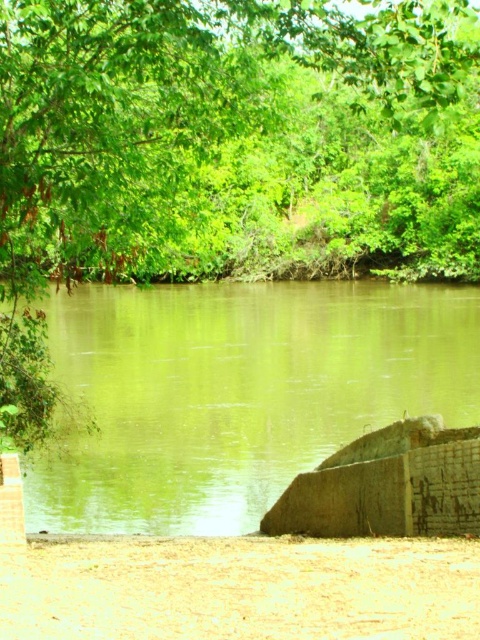
Is green leafy tree at upper center closer to camera compared to greenish-brown water at center?

Yes, green leafy tree at upper center is in front of greenish-brown water at center.

Can you confirm if green leafy tree at upper center is smaller than greenish-brown water at center?

Incorrect, green leafy tree at upper center is not smaller in size than greenish-brown water at center.

Who is more forward, [448,161] or [216,500]?

Point [216,500] is more forward.

Where is `green leafy tree at upper center`? The image size is (480, 640). green leafy tree at upper center is located at coordinates (226, 154).